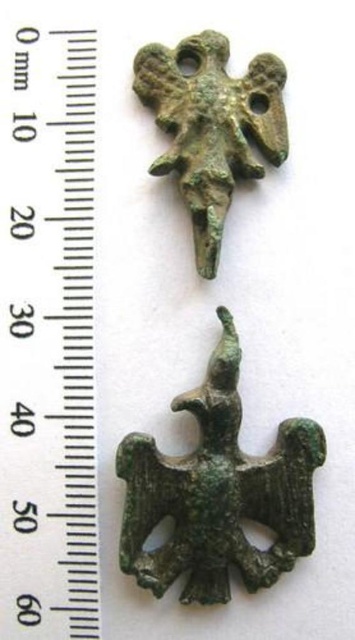
You are an archaeologist examining the artifacts. You need to determine which object is bigger between the metallic ruler at upper left and the green bronze eagle at upper center. Based on the scene, which one is larger?

Answer: The metallic ruler at upper left is larger in size than the green bronze eagle at upper center.

You are an archaeologist examining two ancient eagle pendants next to a ruler. You need to determine which pendant is wider. The pendants are the green patina metal eagle at center and the green bronze eagle at upper center. Which one has a greater width?

The green patina metal eagle at center has a greater width than the green bronze eagle at upper center.